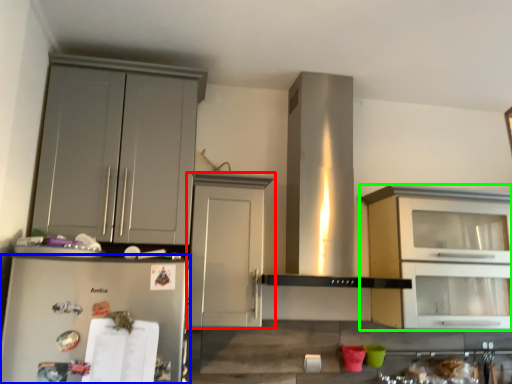
Question: Based on their relative distances, which object is farther from cabinetry (highlighted by a red box)? Choose from refrigerator (highlighted by a blue box) and cabinetry (highlighted by a green box).

Choices:
 (A) refrigerator
 (B) cabinetry

Answer: (B)